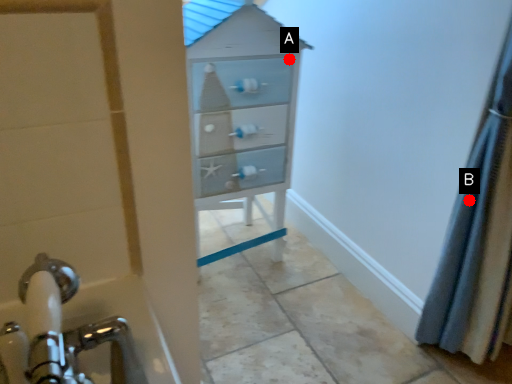
Question: Two points are circled on the image, labeled by A and B beside each circle. Which point is farther to the camera?

Choices:
 (A) A is further
 (B) B is further

Answer: (A)